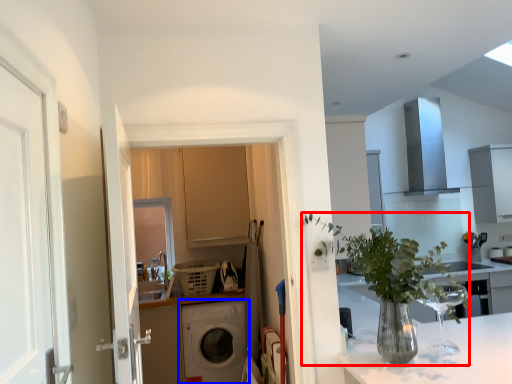
Question: Which point is further to the camera, houseplant (highlighted by a red box) or washing machine (highlighted by a blue box)?

Choices:
 (A) houseplant
 (B) washing machine

Answer: (B)